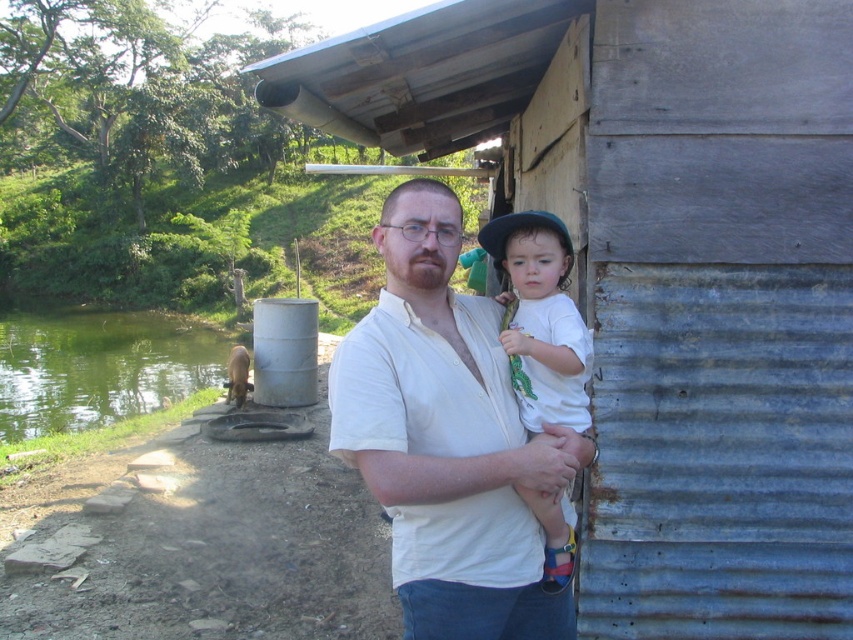
Between point (769, 108) and point (556, 561), which one is positioned in front?

Point (556, 561) is more forward.

From the picture: Who is shorter, rusty corrugated metal hut at center-right or white matte shirt at center?

white matte shirt at center is shorter.

Who is more distant from viewer, (728, 81) or (515, 337)?

Point (728, 81)

The height and width of the screenshot is (640, 853). Identify the location of rusty corrugated metal hut at center-right. (660, 269).

Can you confirm if rusty corrugated metal hut at center-right is bigger than white cotton shirt at center?

Yes.

Is point (744, 456) positioned before point (463, 518)?

No, it is not.

I want to click on rusty corrugated metal hut at center-right, so click(660, 269).

Who is positioned more to the left, white cotton shirt at center or white matte shirt at center?

white cotton shirt at center is more to the left.

Can you confirm if white cotton shirt at center is smaller than white matte shirt at center?

Yes, white cotton shirt at center is smaller than white matte shirt at center.

What do you see at coordinates (447, 438) in the screenshot? This screenshot has height=640, width=853. I see `white cotton shirt at center` at bounding box center [447, 438].

The height and width of the screenshot is (640, 853). What are the coordinates of `white cotton shirt at center` in the screenshot? It's located at (447, 438).